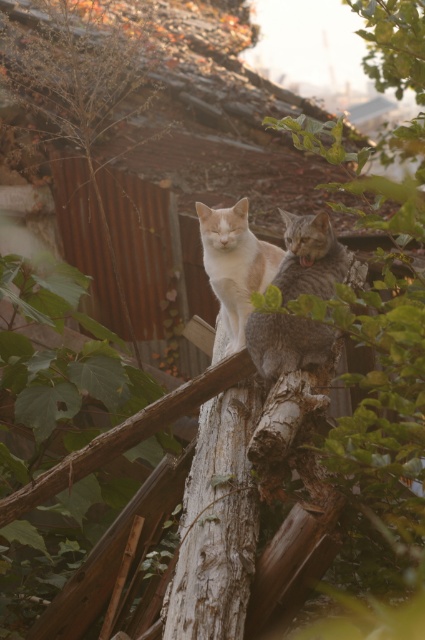
Question: Which object is closer to the camera taking this photo?

Choices:
 (A) white fur cat at center
 (B) white textured wood at center
 (C) smooth brown wood at center
 (D) gray textured cat at center

Answer: (B)

Question: Does white textured wood at center have a lesser width compared to smooth brown wood at center?

Choices:
 (A) no
 (B) yes

Answer: (B)

Question: Which of the following is the closest to the observer?

Choices:
 (A) (212, 211)
 (B) (238, 584)

Answer: (B)

Question: Which point appears farthest from the camera in this image?

Choices:
 (A) (311, 243)
 (B) (229, 387)
 (C) (223, 285)

Answer: (C)

Question: Can you confirm if gray textured cat at center is positioned above white fur cat at center?

Choices:
 (A) yes
 (B) no

Answer: (B)

Question: Is white textured wood at center smaller than smooth brown wood at center?

Choices:
 (A) yes
 (B) no

Answer: (B)